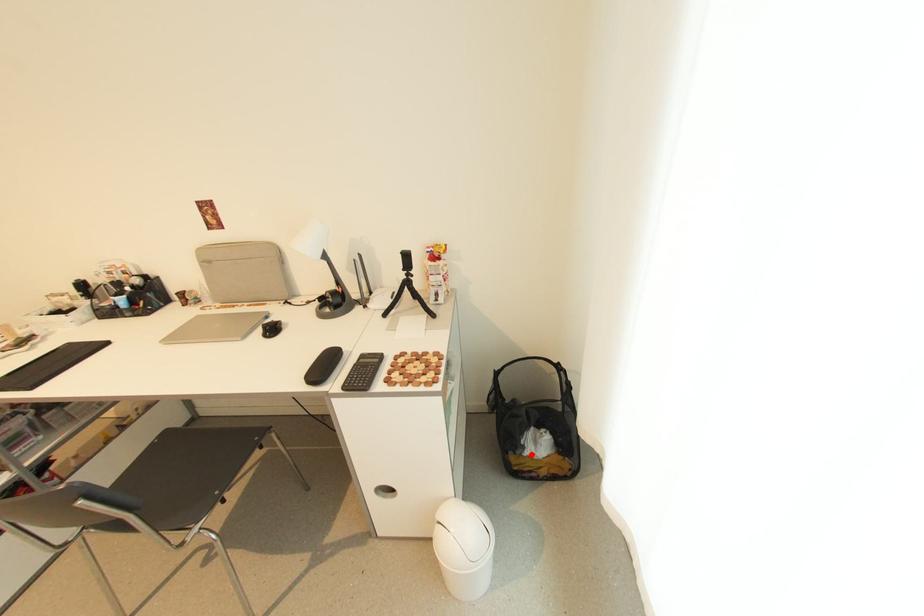
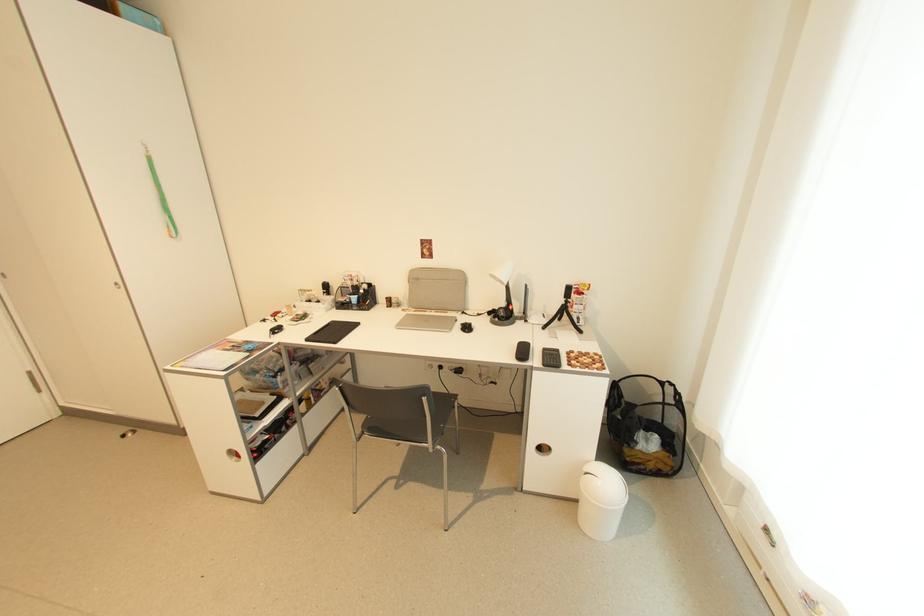
Question: I am providing you with two images of the same scene from different viewpoints. A red point is shown in image1. For the corresponding object point in image2, is it positioned nearer or farther from the camera?

Choices:
 (A) Nearer
 (B) Farther

Answer: (A)